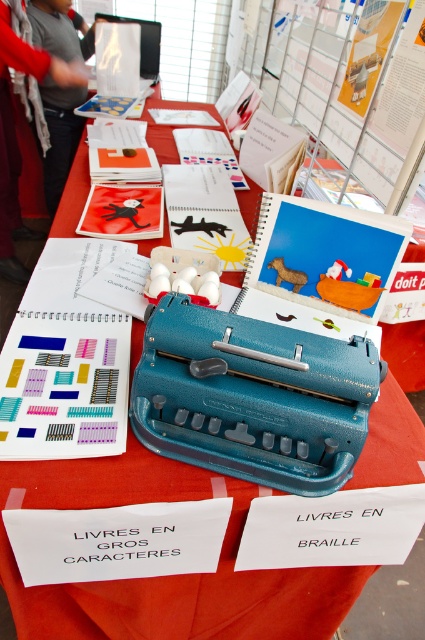
Who is taller, teal plastic typewriter at center or gray fabric jacket at upper left?

gray fabric jacket at upper left

Does point (142, 364) lie in front of point (34, 81)?

That is True.

I want to click on teal plastic typewriter at center, so click(252, 396).

Can you confirm if gray fabric jacket at upper left is positioned above gray sweater at upper left?

No, gray fabric jacket at upper left is not above gray sweater at upper left.

Does gray fabric jacket at upper left have a greater height compared to gray sweater at upper left?

Indeed, gray fabric jacket at upper left has a greater height compared to gray sweater at upper left.

At what (x,y) coordinates should I click in order to perform the action: click on gray fabric jacket at upper left. Please return your answer as a coordinate pair (x, y). The width and height of the screenshot is (425, 640). Looking at the image, I should click on (14, 122).

The height and width of the screenshot is (640, 425). Identify the location of gray fabric jacket at upper left. (14, 122).

The height and width of the screenshot is (640, 425). What are the coordinates of `teal plastic typewriter at center` in the screenshot? It's located at (252, 396).

Which is below, teal plastic typewriter at center or gray sweater at upper left?

teal plastic typewriter at center is below.

Is point (232, 324) closer to viewer compared to point (48, 84)?

Yes, point (232, 324) is in front of point (48, 84).

Where is `teal plastic typewriter at center`? The image size is (425, 640). teal plastic typewriter at center is located at coordinates (252, 396).